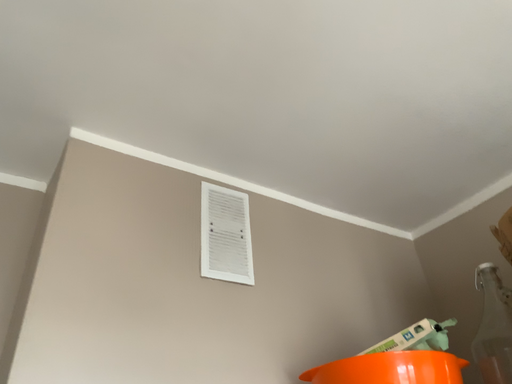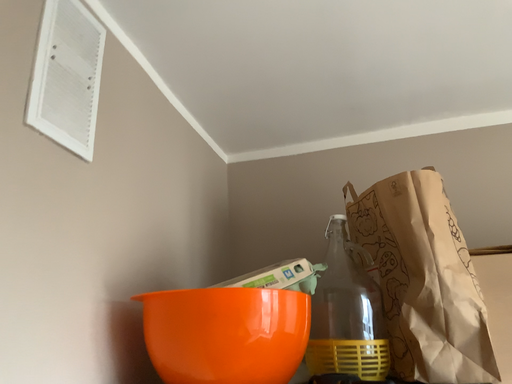
Question: Which way did the camera rotate in the video?

Choices:
 (A) rotated upward
 (B) rotated downward

Answer: (B)